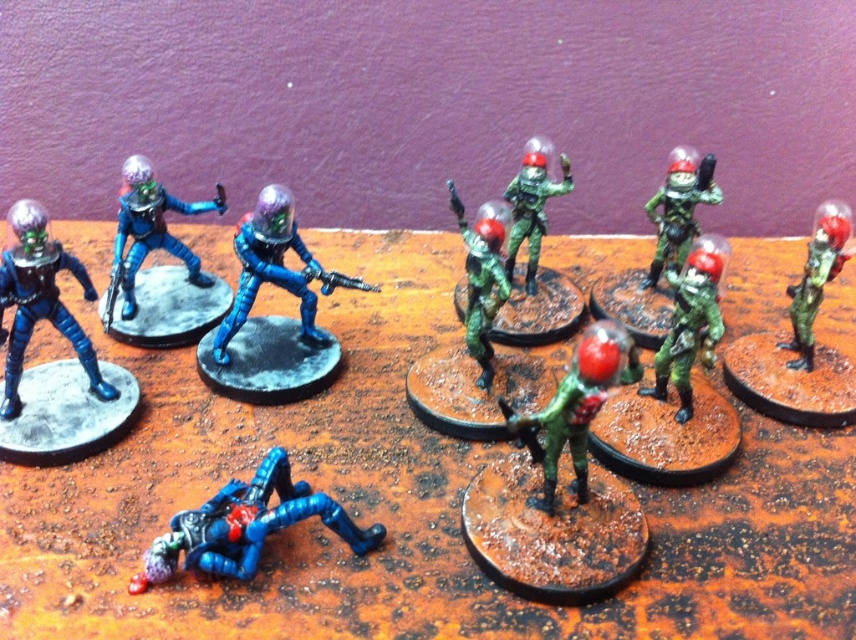
Which is above, brushed metal figure at lower left or brushed metal figure at left?

Positioned higher is brushed metal figure at left.

Find the location of `brushed metal figure at lower left`. brushed metal figure at lower left is located at coordinates (244, 525).

You are a GUI agent. You are given a task and a screenshot of the screen. Output one action in this format:
    pyautogui.click(x=<x>, y=<y>)
    Task: Click on the brushed metal figure at lower left
    Image resolution: width=856 pixels, height=640 pixels.
    Given the screenshot: What is the action you would take?
    pyautogui.click(x=244, y=525)

Is green matte figure at center shorter than brushed metal figure at center?

In fact, green matte figure at center may be taller than brushed metal figure at center.

Between green matte figure at center and brushed metal figure at center, which one has less height?

Standing shorter between the two is brushed metal figure at center.

Where is `green matte figure at center`? This screenshot has height=640, width=856. green matte figure at center is located at coordinates (575, 404).

Is brushed metal figure at left to the left of green matte helmet at upper right from the viewer's perspective?

Correct, you'll find brushed metal figure at left to the left of green matte helmet at upper right.

Locate an element on the screen. The width and height of the screenshot is (856, 640). brushed metal figure at left is located at coordinates (40, 300).